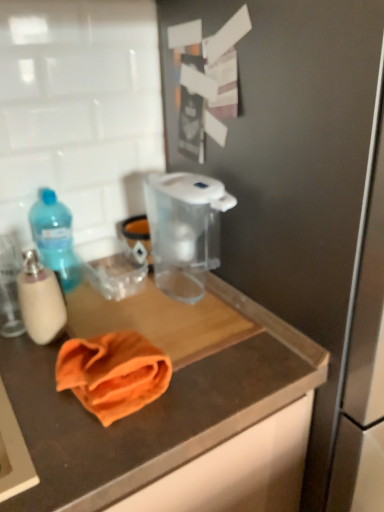
This screenshot has width=384, height=512. In order to click on vacant space underneath transparent plastic pitcher at center (from a real-world perspective) in this screenshot , I will do `click(191, 290)`.